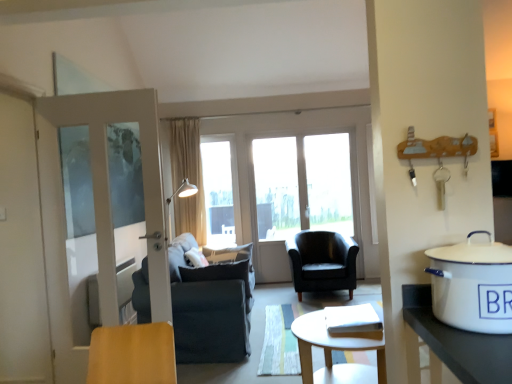
Question: Does beige fabric curtain at center have a larger size compared to black leather armchair at center, the 1th chair in the right-to-left sequence?

Choices:
 (A) yes
 (B) no

Answer: (B)

Question: Can you confirm if beige fabric curtain at center is taller than black leather armchair at center, the second chair in the left-to-right sequence?

Choices:
 (A) yes
 (B) no

Answer: (A)

Question: Is beige fabric curtain at center directly adjacent to black leather armchair at center, marked as the 2th chair in a front-to-back arrangement?

Choices:
 (A) yes
 (B) no

Answer: (B)

Question: From a real-world perspective, is beige fabric curtain at center physically above black leather armchair at center, the second chair in the left-to-right sequence?

Choices:
 (A) no
 (B) yes

Answer: (B)

Question: Considering the relative sizes of beige fabric curtain at center and black leather armchair at center, the 1th chair in the right-to-left sequence, in the image provided, is beige fabric curtain at center smaller than black leather armchair at center, the 1th chair in the right-to-left sequence,?

Choices:
 (A) no
 (B) yes

Answer: (B)

Question: Does beige fabric curtain at center appear on the left side of black leather armchair at center, marked as the 2th chair in a front-to-back arrangement?

Choices:
 (A) no
 (B) yes

Answer: (B)

Question: Is transparent glass window at center positioned before dark gray fabric chair at center, the 1th chair when ordered from front to back?

Choices:
 (A) no
 (B) yes

Answer: (A)

Question: Can you confirm if transparent glass window at center is thinner than dark gray fabric chair at center, the 2th chair viewed from the back?

Choices:
 (A) no
 (B) yes

Answer: (B)

Question: From the image's perspective, would you say transparent glass window at center is shown under dark gray fabric chair at center, the 2th chair viewed from the back?

Choices:
 (A) no
 (B) yes

Answer: (A)

Question: Does transparent glass window at center touch dark gray fabric chair at center, the 1th chair when ordered from front to back?

Choices:
 (A) yes
 (B) no

Answer: (B)

Question: Could you tell me if transparent glass window at center is facing dark gray fabric chair at center, the 1th chair when ordered from front to back?

Choices:
 (A) yes
 (B) no

Answer: (A)

Question: Is transparent glass window at center to the left of dark gray fabric chair at center, the 2th chair viewed from the back, from the viewer's perspective?

Choices:
 (A) yes
 (B) no

Answer: (B)

Question: Does transparent glass window at center appear on the left side of white glossy screen door at left?

Choices:
 (A) yes
 (B) no

Answer: (B)